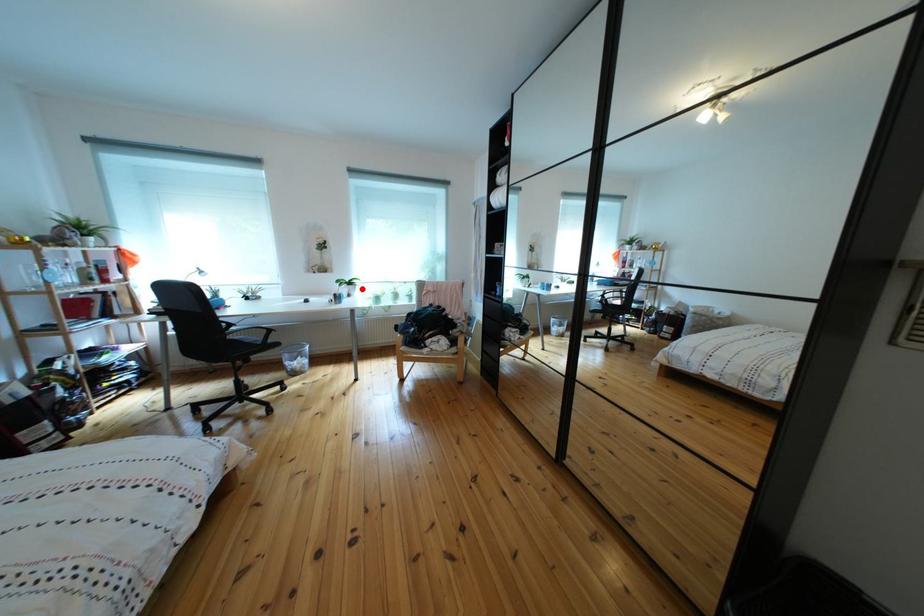
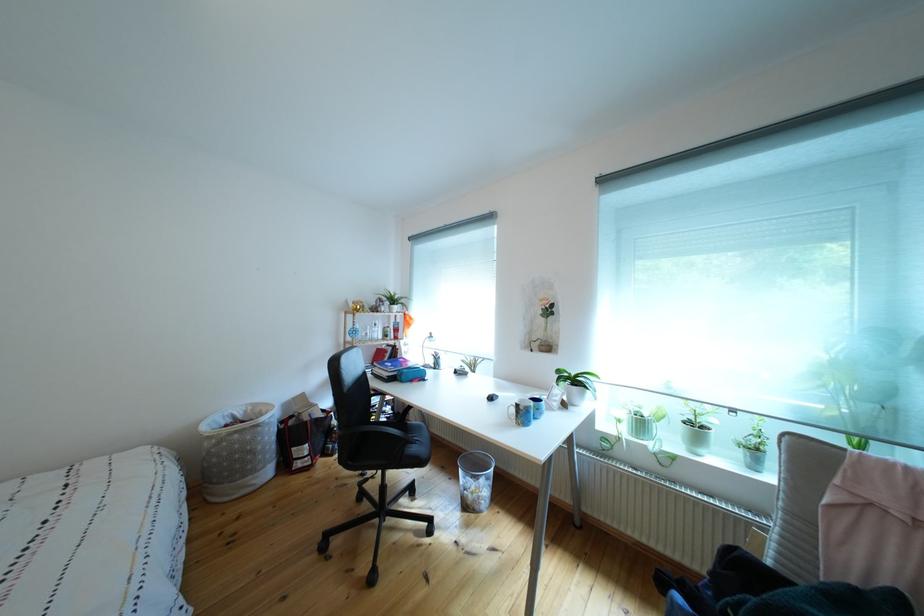
Find the pixel in the second image that matches the highlighted location in the first image.

(588, 387)